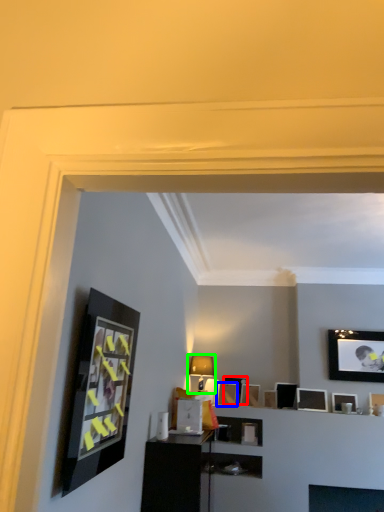
Question: Estimate the real-world distances between objects in this image. Which object is closer to picture frame (highlighted by a red box), picture frame (highlighted by a blue box) or lamp (highlighted by a green box)?

Choices:
 (A) picture frame
 (B) lamp

Answer: (A)